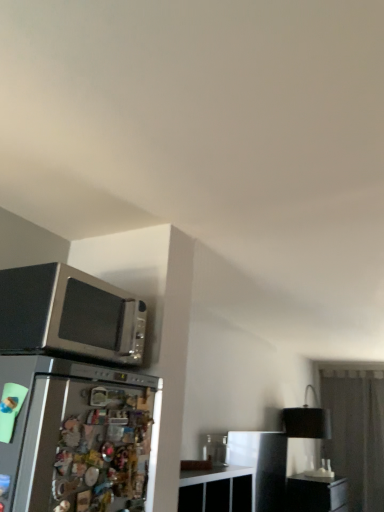
Describe the element at coordinates (69, 315) in the screenshot. I see `satin black microwave at upper left` at that location.

Describe the element at coordinates (356, 432) in the screenshot. This screenshot has height=512, width=384. I see `transparent glass door at right` at that location.

Measure the distance between black matte file cabinet at lower right and camera.

They are 4.51 meters apart.

Locate an element on the screen. satin black microwave at upper left is located at coordinates (69, 315).

Consider the image. Does transparent glass door at right have a smaller size compared to black matte file cabinet at lower right?

Incorrect, transparent glass door at right is not smaller in size than black matte file cabinet at lower right.

From the image's perspective, which is below, transparent glass door at right or black matte file cabinet at lower right?

black matte file cabinet at lower right is shown below in the image.

Can you confirm if transparent glass door at right is thinner than black matte file cabinet at lower right?

Yes.

Can you confirm if black matte file cabinet at lower right is bigger than transparent glass door at right?

Actually, black matte file cabinet at lower right might be smaller than transparent glass door at right.

Is black matte file cabinet at lower right next to transparent glass door at right?

They are not placed beside each other.

From the image's perspective, is black matte file cabinet at lower right above transparent glass door at right?

No.

Locate an element on the screen. The width and height of the screenshot is (384, 512). file cabinet below the transparent glass door at right (from the image's perspective) is located at coordinates (316, 494).

Is satin black microwave at upper left at the right side of black matte lampshade at right?

No, satin black microwave at upper left is not to the right of black matte lampshade at right.

From their relative heights in the image, would you say satin black microwave at upper left is taller or shorter than black matte lampshade at right?

Considering their sizes, satin black microwave at upper left has less height than black matte lampshade at right.

Considering the sizes of satin black microwave at upper left and black matte lampshade at right in the image, is satin black microwave at upper left wider or thinner than black matte lampshade at right?

satin black microwave at upper left is thinner than black matte lampshade at right.

Which is nearer, (x=26, y=308) or (x=315, y=415)?

Clearly, point (x=26, y=308) is closer to the camera than point (x=315, y=415).

Find the location of a particular element. glass door located below the satin black microwave at upper left (from the image's perspective) is located at coordinates (356, 432).

Considering the positions of point (61, 277) and point (357, 473), is point (61, 277) closer or farther from the camera than point (357, 473)?

Point (61, 277) is positioned closer to the camera compared to point (357, 473).

Based on the photo, does satin black microwave at upper left turn towards transparent glass door at right?

No, satin black microwave at upper left is not oriented towards transparent glass door at right.

Is satin black microwave at upper left next to transparent glass door at right and touching it?

No, satin black microwave at upper left is not making contact with transparent glass door at right.

Find the location of a particular element. This screenshot has height=512, width=384. lamp in front of the black matte file cabinet at lower right is located at coordinates (307, 420).

Is black matte file cabinet at lower right aimed at black matte lampshade at right?

No, black matte file cabinet at lower right is not oriented towards black matte lampshade at right.

Looking at this image, is black matte file cabinet at lower right thinner than black matte lampshade at right?

No, black matte file cabinet at lower right is not thinner than black matte lampshade at right.

Between black matte file cabinet at lower right and black matte lampshade at right, which one has larger size?

With larger size is black matte lampshade at right.

Can you confirm if transparent glass door at right is positioned to the right of satin black microwave at upper left?

Indeed, transparent glass door at right is positioned on the right side of satin black microwave at upper left.

Based on their sizes in the image, would you say transparent glass door at right is bigger or smaller than satin black microwave at upper left?

In the image, transparent glass door at right appears to be larger than satin black microwave at upper left.

Locate an element on the screen. glass door on the right of satin black microwave at upper left is located at coordinates (356, 432).

Between transparent glass door at right and black matte lampshade at right, which one has less height?

With less height is black matte lampshade at right.

Consider the image. Are transparent glass door at right and black matte lampshade at right far apart?

That's right, there is a large distance between transparent glass door at right and black matte lampshade at right.

Is transparent glass door at right inside or outside of black matte lampshade at right?

transparent glass door at right is not enclosed by black matte lampshade at right.

Locate an element on the screen. The image size is (384, 512). glass door below the black matte lampshade at right (from the image's perspective) is located at coordinates (356, 432).

Locate an element on the screen. The width and height of the screenshot is (384, 512). glass door lying on the right of black matte file cabinet at lower right is located at coordinates (356, 432).

The image size is (384, 512). I want to click on file cabinet located in front of the transparent glass door at right, so pyautogui.click(x=316, y=494).

Considering their positions, is transparent glass door at right positioned further to black matte file cabinet at lower right than satin black microwave at upper left?

Based on the image, satin black microwave at upper left appears to be further to black matte file cabinet at lower right.

In the scene shown: Which object lies further to the anchor point black matte lampshade at right, satin black microwave at upper left or black matte file cabinet at lower right?

satin black microwave at upper left is positioned further to the anchor black matte lampshade at right.

Looking at the image, which one is located further to black matte file cabinet at lower right, black matte lampshade at right or transparent glass door at right?

Based on the image, transparent glass door at right appears to be further to black matte file cabinet at lower right.

Estimate the real-world distances between objects in this image. Which object is further from black matte lampshade at right, transparent glass door at right or satin black microwave at upper left?

Among the two, satin black microwave at upper left is located further to black matte lampshade at right.

Estimate the real-world distances between objects in this image. Which object is closer to black matte file cabinet at lower right, black matte lampshade at right or satin black microwave at upper left?

Based on the image, black matte lampshade at right appears to be nearer to black matte file cabinet at lower right.

When comparing their distances from satin black microwave at upper left, does black matte lampshade at right or transparent glass door at right seem further?

transparent glass door at right is positioned further to the anchor satin black microwave at upper left.

Estimate the real-world distances between objects in this image. Which object is closer to transparent glass door at right, black matte lampshade at right or satin black microwave at upper left?

black matte lampshade at right lies closer to transparent glass door at right than the other object.

Based on their spatial positions, is satin black microwave at upper left or black matte lampshade at right further from black matte file cabinet at lower right?

satin black microwave at upper left.

Find the location of a particular element. The width and height of the screenshot is (384, 512). file cabinet located between black matte lampshade at right and transparent glass door at right in the depth direction is located at coordinates (316, 494).

Where is `file cabinet positioned between satin black microwave at upper left and transparent glass door at right from near to far`? This screenshot has width=384, height=512. file cabinet positioned between satin black microwave at upper left and transparent glass door at right from near to far is located at coordinates (316, 494).

The image size is (384, 512). I want to click on lamp between satin black microwave at upper left and transparent glass door at right in the front-back direction, so click(x=307, y=420).

Find the location of a particular element. The image size is (384, 512). lamp positioned between satin black microwave at upper left and black matte file cabinet at lower right from near to far is located at coordinates (x=307, y=420).